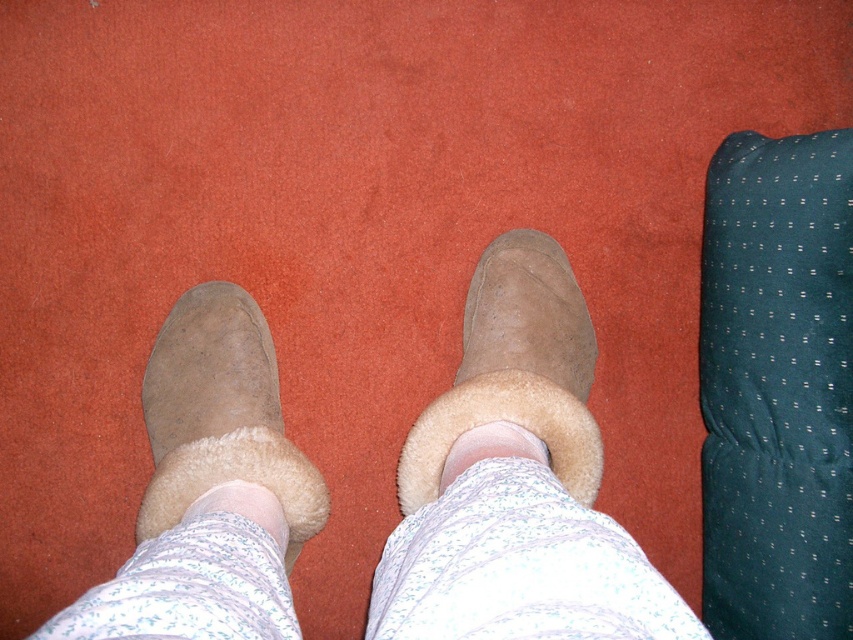
You are standing in a room and see two points marked on the floor. The first point is at position point (x=782, y=424) and the second point is at point (x=277, y=541). If you are facing the direction of the green cushion with a dotted pattern to your right, which point is closer to you?

Point (x=277, y=541) is closer to you because point (x=782, y=424) is behind it.

You are standing in a room and want to reach the point marked as point (802,579). If you take a step forward, will you be closer to the camera or farther away?

The distance between point (802,579) and the camera is 33.34 inches. If you take a step forward towards the point, you will be closer to the camera.

You are a delivery robot that needs to place a small package between the dark green dotted pillow at right and the white fluffy ankle at center. The package is 12 inches long. Is there enough space between them to fit the package?

The dark green dotted pillow at right is 23.43 inches from the white fluffy ankle at center. Since the package is 12 inches long, which is less than the distance between them, there is enough space to fit the package between the dark green dotted pillow at right and the white fluffy ankle at center.